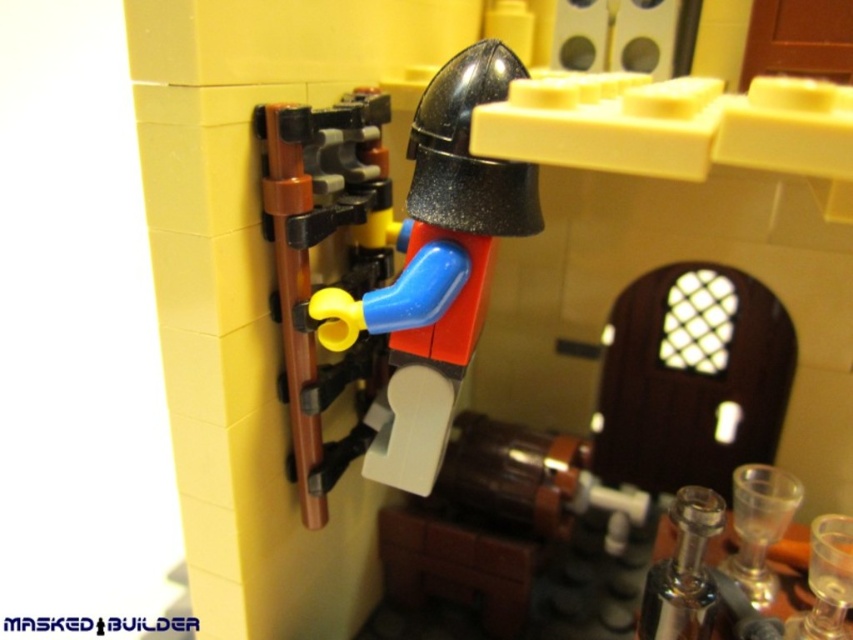
Question: Is matte black helmet at center positioned before yellow matte lever at center?

Choices:
 (A) no
 (B) yes

Answer: (B)

Question: Where is matte black helmet at center located in relation to yellow matte lever at center in the image?

Choices:
 (A) left
 (B) right

Answer: (B)

Question: Is matte black helmet at center further to camera compared to yellow matte lever at center?

Choices:
 (A) yes
 (B) no

Answer: (B)

Question: Which of the following is the farthest from the observer?

Choices:
 (A) yellow matte lever at center
 (B) matte black helmet at center

Answer: (A)

Question: Which point is farther to the camera?

Choices:
 (A) (311, 422)
 (B) (512, 170)

Answer: (A)